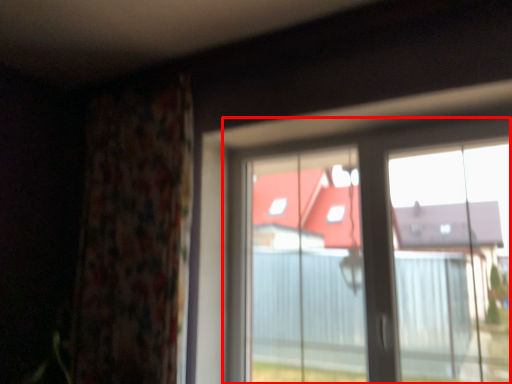
Question: Observing the image, what is the correct spatial positioning of window (annotated by the red box) in reference to curtain?

Choices:
 (A) left
 (B) right

Answer: (B)